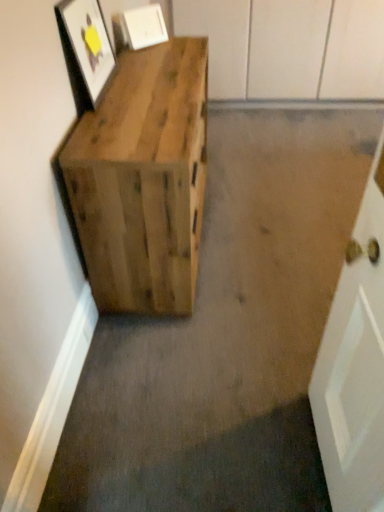
Where is `vacant space to the right of matte white picture frame at upper center, placed as the 2th picture frame when sorted from front to back`? The width and height of the screenshot is (384, 512). vacant space to the right of matte white picture frame at upper center, placed as the 2th picture frame when sorted from front to back is located at coordinates (183, 42).